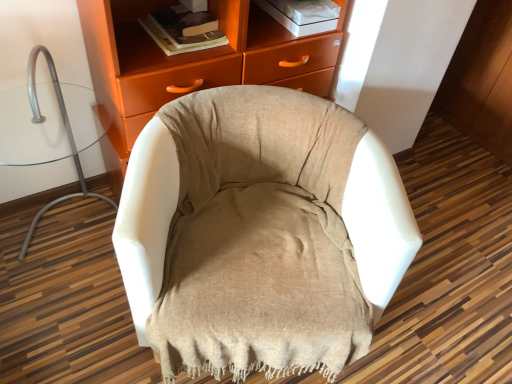
What do you see at coordinates (190, 63) in the screenshot?
I see `matte orange cabinet at upper center` at bounding box center [190, 63].

In order to face hardcover book at upper center, should I rotate leftwards or rightwards?

Turn left by 10.261 degrees to look at hardcover book at upper center.

Locate an element on the screen. beige fabric chair at center is located at coordinates (260, 234).

From a real-world perspective, relative to beige fabric chair at center, is white fabric chair at left vertically above or below?

From a real-world perspective, white fabric chair at left is physically above beige fabric chair at center.

Considering the sizes of objects white fabric chair at left and beige fabric chair at center in the image provided, who is shorter, white fabric chair at left or beige fabric chair at center?

Standing shorter between the two is beige fabric chair at center.

Is white fabric chair at left further to camera compared to beige fabric chair at center?

Yes, white fabric chair at left is behind beige fabric chair at center.

Is white fabric chair at left bigger or smaller than beige fabric chair at center?

In the image, white fabric chair at left appears to be smaller than beige fabric chair at center.

Is matte orange cabinet at upper center at the back of hardcover book at upper center?

Absolutely, hardcover book at upper center is directed away from matte orange cabinet at upper center.

Which of these two, hardcover book at upper center or matte orange cabinet at upper center, stands shorter?

With less height is hardcover book at upper center.

Between hardcover book at upper center and matte orange cabinet at upper center, which one has larger size?

matte orange cabinet at upper center is bigger.

Is hardcover book at upper center in front of or behind matte orange cabinet at upper center in the image?

hardcover book at upper center is positioned farther from the viewer than matte orange cabinet at upper center.

How distant is beige fabric chair at center from white fabric chair at left?

They are 32.21 inches apart.

In terms of width, does beige fabric chair at center look wider or thinner when compared to white fabric chair at left?

Clearly, beige fabric chair at center has more width compared to white fabric chair at left.

Is beige fabric chair at center taller than white fabric chair at left?

No.

Is white fabric chair at left behind matte orange cabinet at upper center?

No.

Find the location of `computer chair located below the matte orange cabinet at upper center (from the image's perspective)`. computer chair located below the matte orange cabinet at upper center (from the image's perspective) is located at coordinates (67, 136).

Does point (57, 93) lie in front of point (114, 14)?

That is False.

Is white fabric chair at left not inside matte orange cabinet at upper center?

Indeed, white fabric chair at left is completely outside matte orange cabinet at upper center.

Are hardcover book at upper center and white fabric chair at left far apart?

hardcover book at upper center is actually quite close to white fabric chair at left.

In terms of width, does hardcover book at upper center look wider or thinner when compared to white fabric chair at left?

Clearly, hardcover book at upper center has less width compared to white fabric chair at left.

Considering the relative sizes of hardcover book at upper center and white fabric chair at left in the image provided, is hardcover book at upper center shorter than white fabric chair at left?

Yes.

From a real-world perspective, between hardcover book at upper center and white fabric chair at left, who is vertically lower?

In real-world perspective, white fabric chair at left is lower.

Is beige fabric chair at center facing away from matte orange cabinet at upper center?

Yes.

Where is `chair that is below the matte orange cabinet at upper center (from the image's perspective)`? Image resolution: width=512 pixels, height=384 pixels. chair that is below the matte orange cabinet at upper center (from the image's perspective) is located at coordinates (260, 234).

From a real-world perspective, who is located higher, beige fabric chair at center or matte orange cabinet at upper center?

In real-world perspective, matte orange cabinet at upper center is above.

Considering the relative sizes of beige fabric chair at center and hardcover book at upper center in the image provided, is beige fabric chair at center smaller than hardcover book at upper center?

No, beige fabric chair at center is not smaller than hardcover book at upper center.

Is beige fabric chair at center facing away from hardcover book at upper center?

Yes, beige fabric chair at center is positioned with its back facing hardcover book at upper center.

Which object is closer to the camera, beige fabric chair at center or hardcover book at upper center?

Positioned in front is beige fabric chair at center.

Considering the relative sizes of beige fabric chair at center and hardcover book at upper center in the image provided, is beige fabric chair at center taller than hardcover book at upper center?

Yes.

You are a GUI agent. You are given a task and a screenshot of the screen. Output one action in this format:
    pyautogui.click(x=<x>, y=<y>)
    Task: Click on the chair below the white fabric chair at left (from a real-world perspective)
    The height and width of the screenshot is (384, 512).
    Given the screenshot: What is the action you would take?
    pyautogui.click(x=260, y=234)

Identify the location of book that is above the matte orange cabinet at upper center (from the image's perspective). This screenshot has width=512, height=384. (183, 29).

Which object lies nearer to the anchor point white fabric chair at left, beige fabric chair at center or matte orange cabinet at upper center?

matte orange cabinet at upper center is closer to white fabric chair at left.

From the image, which object appears to be farther from matte orange cabinet at upper center, hardcover book at upper center or white fabric chair at left?

white fabric chair at left is further to matte orange cabinet at upper center.

Based on their spatial positions, is beige fabric chair at center or matte orange cabinet at upper center closer to hardcover book at upper center?

Among the two, matte orange cabinet at upper center is located nearer to hardcover book at upper center.

From the image, which object appears to be farther from hardcover book at upper center, matte orange cabinet at upper center or white fabric chair at left?

white fabric chair at left is further to hardcover book at upper center.

From the image, which object appears to be farther from matte orange cabinet at upper center, hardcover book at upper center or beige fabric chair at center?

beige fabric chair at center lies further to matte orange cabinet at upper center than the other object.

Which object lies nearer to the anchor point matte orange cabinet at upper center, beige fabric chair at center or hardcover book at upper center?

hardcover book at upper center is closer to matte orange cabinet at upper center.

Considering their positions, is matte orange cabinet at upper center positioned further to hardcover book at upper center than beige fabric chair at center?

Based on the image, beige fabric chair at center appears to be further to hardcover book at upper center.

Considering their positions, is hardcover book at upper center positioned further to beige fabric chair at center than white fabric chair at left?

Based on the image, white fabric chair at left appears to be further to beige fabric chair at center.

The width and height of the screenshot is (512, 384). What are the coordinates of `book located between white fabric chair at left and matte orange cabinet at upper center in the left-right direction` in the screenshot? It's located at (183, 29).

Find the location of a particular element. This screenshot has height=384, width=512. computer chair between hardcover book at upper center and beige fabric chair at center from top to bottom is located at coordinates (67, 136).

This screenshot has height=384, width=512. Identify the location of chest of drawers between white fabric chair at left and beige fabric chair at center in the horizontal direction. (190, 63).

Where is `chest of drawers between hardcover book at upper center and beige fabric chair at center in the vertical direction`? The image size is (512, 384). chest of drawers between hardcover book at upper center and beige fabric chair at center in the vertical direction is located at coordinates (190, 63).